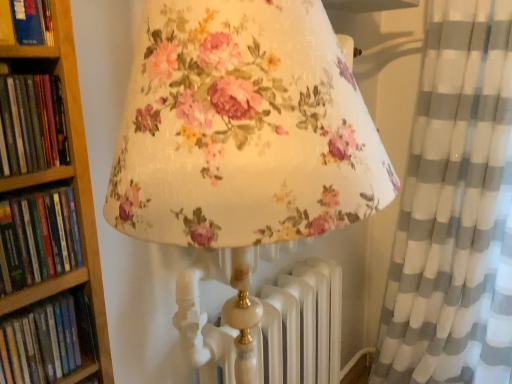
Question: Is hardcover book at upper left, which appears as the 4th book when ordered from the bottom, next to green matte book at left, which ranks as the 3th book in bottom-to-top order, and touching it?

Choices:
 (A) no
 (B) yes

Answer: (B)

Question: From the image's perspective, is hardcover book at upper left, which appears as the 4th book when ordered from the bottom, on top of green matte book at left, which ranks as the 3th book in bottom-to-top order?

Choices:
 (A) yes
 (B) no

Answer: (A)

Question: From a real-world perspective, is hardcover book at upper left, which appears as the 4th book when ordered from the bottom, located higher than green matte book at left, which ranks as the 3th book in bottom-to-top order?

Choices:
 (A) yes
 (B) no

Answer: (A)

Question: Does hardcover book at upper left, which appears as the 4th book when ordered from the bottom, have a smaller size compared to green matte book at left, arranged as the second book when viewed from the top?

Choices:
 (A) yes
 (B) no

Answer: (B)

Question: Is hardcover book at upper left, which appears as the 4th book when ordered from the bottom, thinner than green matte book at left, arranged as the second book when viewed from the top?

Choices:
 (A) no
 (B) yes

Answer: (A)

Question: Considering the positions of hardcover book at left, the 1th book in the bottom-to-top sequence, and white/grey striped curtain at right in the image, is hardcover book at left, the 1th book in the bottom-to-top sequence, wider or thinner than white/grey striped curtain at right?

Choices:
 (A) thin
 (B) wide

Answer: (A)

Question: Considering the positions of hardcover book at left, arranged as the 4th book when viewed from the top, and white/grey striped curtain at right in the image, is hardcover book at left, arranged as the 4th book when viewed from the top, bigger or smaller than white/grey striped curtain at right?

Choices:
 (A) small
 (B) big

Answer: (A)

Question: Considering the positions of point (67, 296) and point (429, 233), is point (67, 296) closer or farther from the camera than point (429, 233)?

Choices:
 (A) closer
 (B) farther

Answer: (A)

Question: In the image, is hardcover book at left, the 1th book in the bottom-to-top sequence, on the left side or the right side of white/grey striped curtain at right?

Choices:
 (A) left
 (B) right

Answer: (A)

Question: Considering the positions of green matte book at left, arranged as the second book when viewed from the top, and hardcover book at left, the 1th book in the bottom-to-top sequence, in the image, is green matte book at left, arranged as the second book when viewed from the top, wider or thinner than hardcover book at left, the 1th book in the bottom-to-top sequence,?

Choices:
 (A) wide
 (B) thin

Answer: (A)

Question: Looking at the image, does green matte book at left, which ranks as the 3th book in bottom-to-top order, seem bigger or smaller compared to hardcover book at left, arranged as the 4th book when viewed from the top?

Choices:
 (A) big
 (B) small

Answer: (A)

Question: Is point (16, 74) closer or farther from the camera than point (57, 311)?

Choices:
 (A) farther
 (B) closer

Answer: (B)

Question: From the image's perspective, is green matte book at left, which ranks as the 3th book in bottom-to-top order, located above or below hardcover book at left, the 1th book in the bottom-to-top sequence?

Choices:
 (A) above
 (B) below

Answer: (A)

Question: From the image's perspective, is hardcover book at upper left, placed as the 1th book when sorted from top to bottom, above or below hardcover book at left, the second book positioned from the bottom?

Choices:
 (A) below
 (B) above

Answer: (B)

Question: Is point (25, 11) positioned closer to the camera than point (54, 268)?

Choices:
 (A) closer
 (B) farther

Answer: (A)